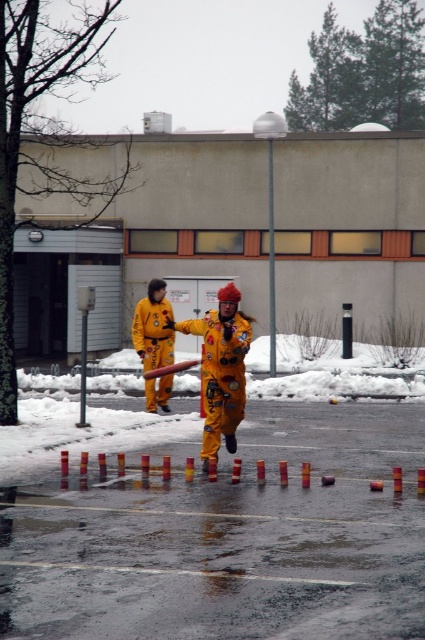
You are a drone operator trying to capture a photo of the yellow fabric fireman at center. The drone is currently at coordinates point A. To ensure the best shot, you need to position the drone directly above the fireman. Given the fireman is at point 0.577 on the x and 0.520 on the y, what coordinates should the drone move to?

The drone should move to point 0.577 on the x and 0.520 on the y to be directly above the yellow fabric fireman at center.